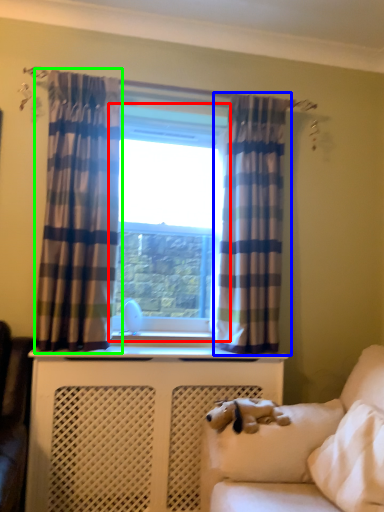
Question: Which is nearer to the window (highlighted by a red box)? curtain (highlighted by a blue box) or curtain (highlighted by a green box).

Choices:
 (A) curtain
 (B) curtain

Answer: (A)